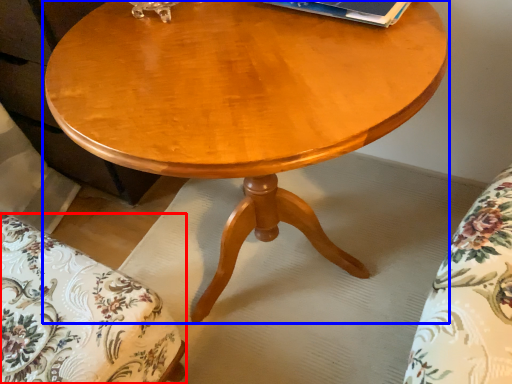
Question: Which of the following is the closest to the observer, swivel chair (highlighted by a red box) or coffee table (highlighted by a blue box)?

Choices:
 (A) swivel chair
 (B) coffee table

Answer: (B)